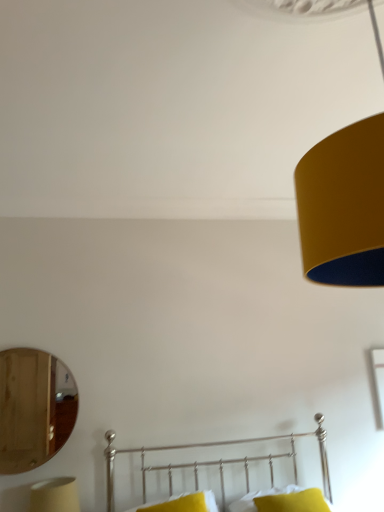
Image resolution: width=384 pixels, height=512 pixels. Find the location of `empty space that is ontop of wooden mirror at left (from a real-world perspective)`. empty space that is ontop of wooden mirror at left (from a real-world perspective) is located at coordinates (34, 345).